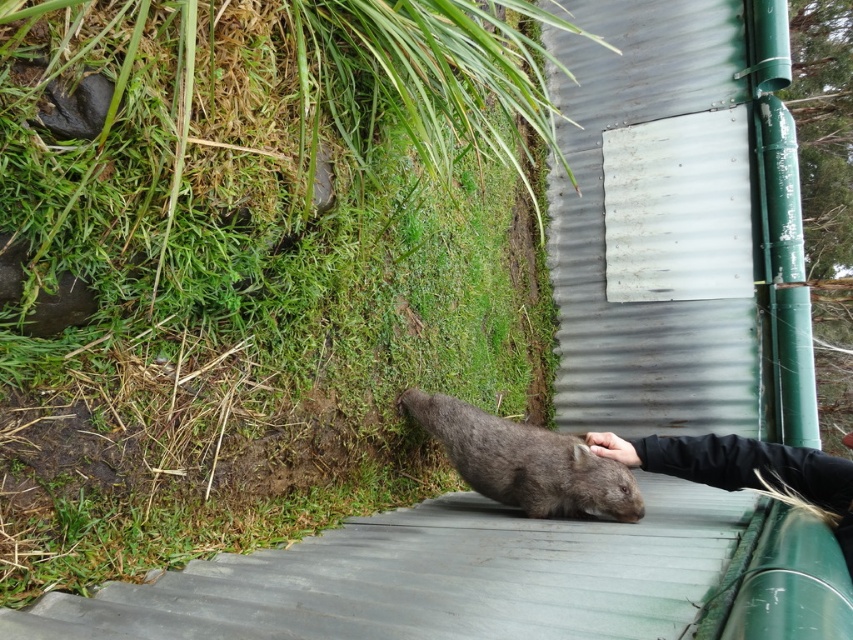
You are a wildlife photographer aiming to capture a closeup shot of the fuzzy gray wombat at lower center. Your camera requires you to be within 2 meters to focus properly. Based on the scene, can you get close enough to take the photo?

The distance between the fuzzy gray wombat at lower center and the viewer is 2.21 meters, which is slightly beyond the 2 meters required for proper focus. Therefore, you cannot get close enough to take the photo.

You are a small animal that can jump up to 1 meter. You want to jump from the green grass at lower left to the black fabric hand at lower center. Can you make the jump?

The distance between the green grass at lower left and the black fabric hand at lower center is 1.24 meters, which is beyond your jumping ability of 1 meter. Therefore, you cannot make the jump.